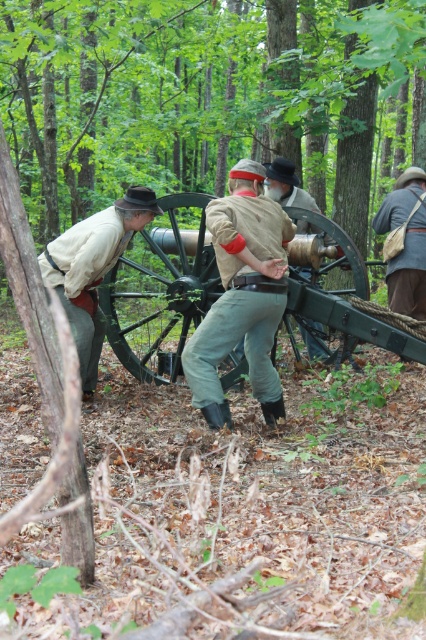
You are a soldier in the reenactment group and need to move the light brown leather hat at left to the right side of the black matte cannon at center. Can you reach the hat from your current position near the cannon without moving around the cannon?

The black matte cannon at center is further to the viewer than the light brown leather hat at left, so the hat is closer to you. Therefore, you can reach the hat from your current position near the cannon without needing to move around it.

You are a costume designer preparing for a historical drama. You have two items from the scene, the light brown leather hat at left and the light brown leather jacket at center. Which item has a greater width measurement?

The light brown leather hat at left has a greater width than the light brown leather jacket at center because the description states that the hat at left surpasses the jacket at center in width.